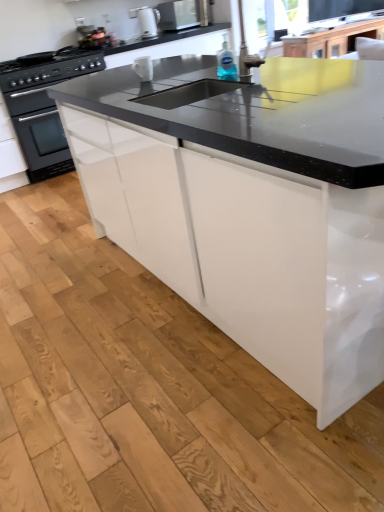
Question: In the image, is white glossy electric kettle at upper center, which appears as the 1th appliance when viewed from the top, on the left side or the right side of white glossy mug at upper center, which appears as the first appliance when viewed from the right?

Choices:
 (A) right
 (B) left

Answer: (B)

Question: Choose the correct answer: Is white glossy electric kettle at upper center, marked as the 2th appliance in a bottom-to-top arrangement, inside white glossy mug at upper center, positioned as the 2th appliance in top-to-bottom order, or outside it?

Choices:
 (A) inside
 (B) outside

Answer: (B)

Question: Which is nearer to the transparent plastic bottle at upper center?

Choices:
 (A) white glossy electric kettle at upper center, which appears as the 1th appliance when viewed from the top
 (B) satin silver microwave at upper center
 (C) white glossy mug at upper center, the 2th appliance when ordered from back to front
 (D) black matte oven at left

Answer: (C)

Question: Estimate the real-world distances between objects in this image. Which object is closer to the white glossy electric kettle at upper center, marked as the 2th appliance in a bottom-to-top arrangement?

Choices:
 (A) black matte oven at left
 (B) transparent plastic bottle at upper center
 (C) white glossy mug at upper center, the second appliance when ordered from left to right
 (D) satin silver microwave at upper center

Answer: (D)